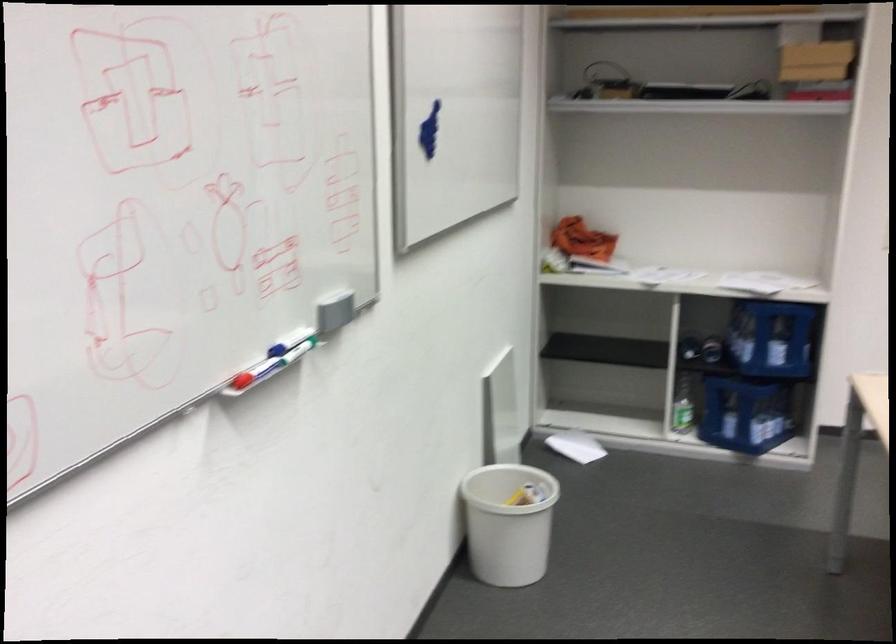
Image resolution: width=896 pixels, height=644 pixels. Identify the location of white paper sheet. (660, 275).